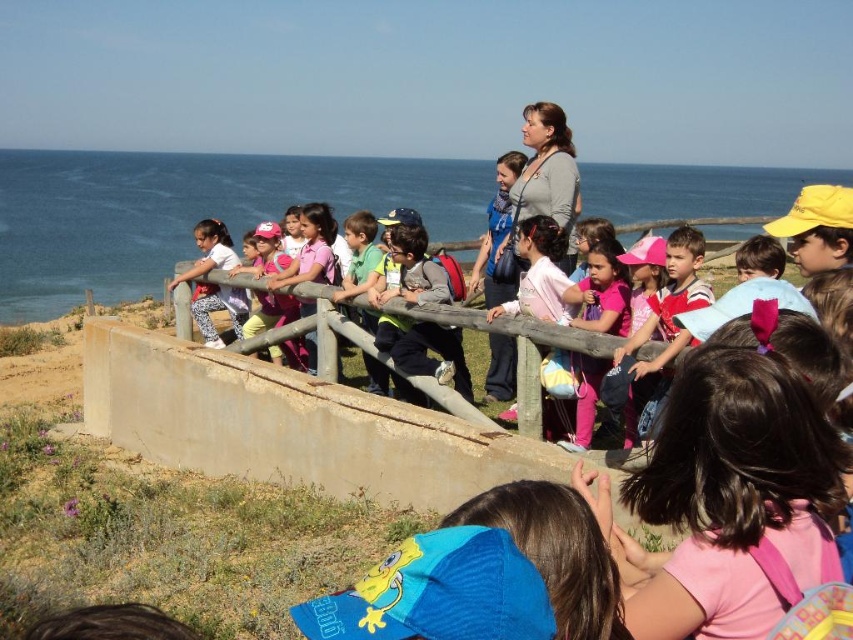
Question: From the image, what is the correct spatial relationship of blue water at upper left in relation to striped shirt at center?

Choices:
 (A) below
 (B) above

Answer: (B)

Question: Can you confirm if matte gray sweater at center is bigger than matte pink pants at left?

Choices:
 (A) yes
 (B) no

Answer: (A)

Question: Which object is positioned closest to the matte gray backpack at center?

Choices:
 (A) matte gray sweater at center
 (B) striped shirt at center
 (C) matte pink pants at left
 (D) blue water at upper left

Answer: (A)

Question: Which object is positioned closest to the blue water at upper left?

Choices:
 (A) striped shirt at center
 (B) matte gray backpack at center
 (C) matte pink pants at left

Answer: (B)

Question: Which is farther from the matte gray sweater at center?

Choices:
 (A) striped shirt at center
 (B) blue water at upper left
 (C) matte pink pants at left
 (D) matte gray backpack at center

Answer: (B)

Question: Is matte gray sweater at center to the right of striped shirt at center from the viewer's perspective?

Choices:
 (A) no
 (B) yes

Answer: (A)